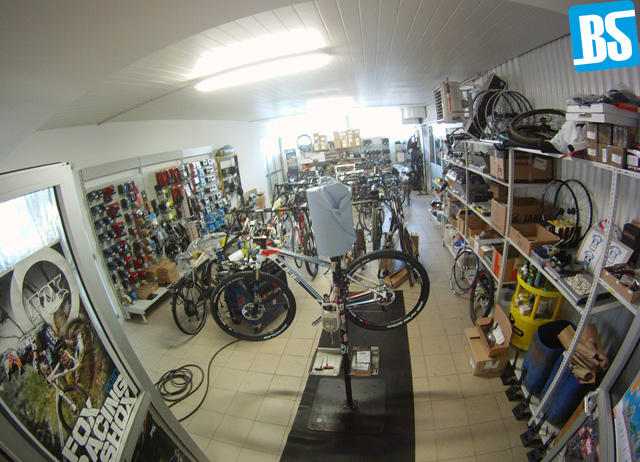
Identify the location of bucket. (539, 359).